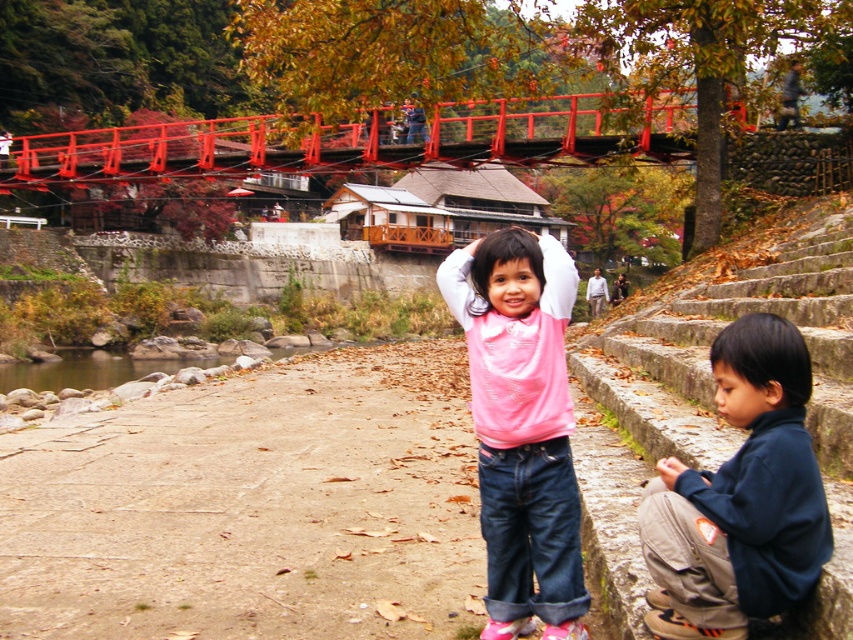
You are a photographer trying to capture a photo of both the dark blue fleece jacket at lower right and the pink matte shirt at center. To ensure both are in the frame, should you adjust your camera angle to the left or the right?

The dark blue fleece jacket at lower right is positioned on the right side of pink matte shirt at center, so you should adjust your camera angle to the left to include both objects in the frame.

You are a photographer trying to capture a photo of the metallic red bridge at upper center without including the dark blue fleece jacket at lower right. Based on their positions, can you position yourself in a way to exclude the jacket from the frame?

The dark blue fleece jacket at lower right is positioned on the right side of the metallic red bridge at upper center. To exclude the jacket, move to the right side of the scene so that the jacket is out of the frame while keeping the bridge centered.

You are a photographer trying to capture the pink matte shirt at center and the metallic red bridge at upper center in a single shot. Based on their positions, which object would appear larger in the photo?

The pink matte shirt at center appears larger in the photo because it is closer to the viewer than the metallic red bridge at upper center.